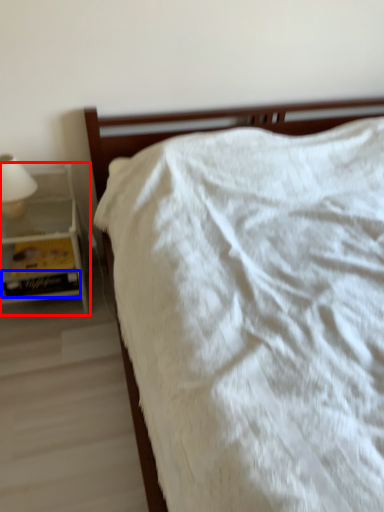
Question: Which object appears farthest to the camera in this image, nightstand (highlighted by a red box) or paperback book (highlighted by a blue box)?

Choices:
 (A) nightstand
 (B) paperback book

Answer: (B)